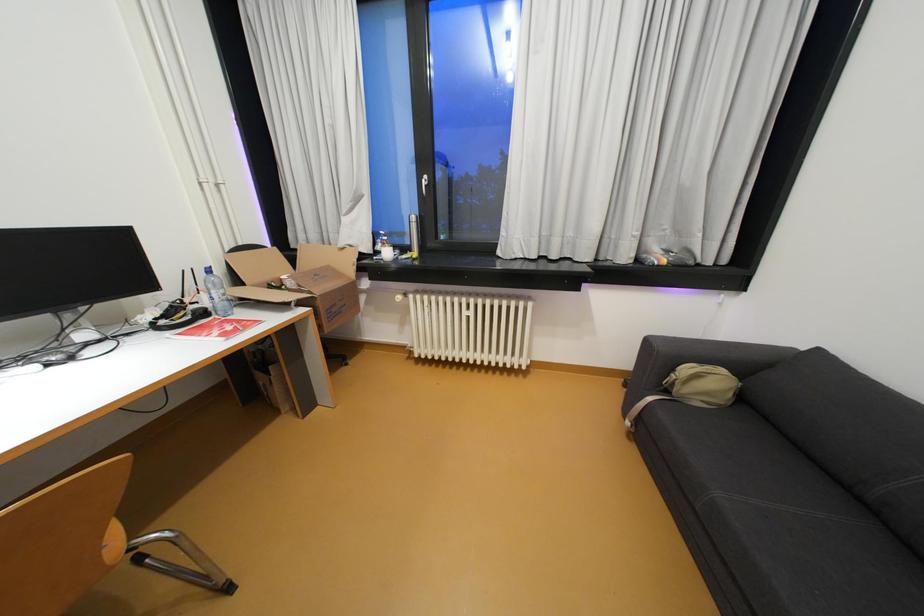
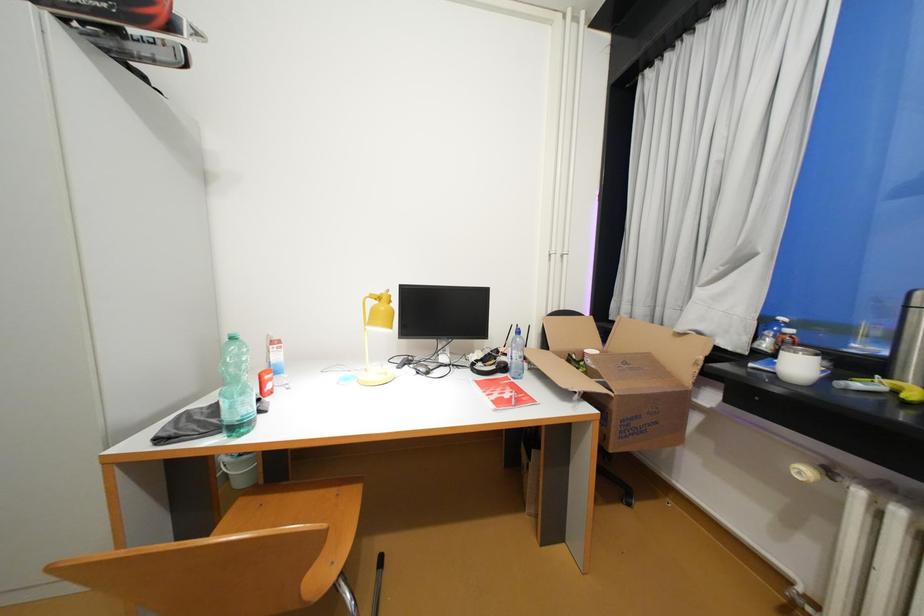
Question: The images are taken continuously from a first-person perspective. In which direction is your viewpoint rotating?

Choices:
 (A) Left
 (B) Right
 (C) Up
 (D) Down

Answer: (A)